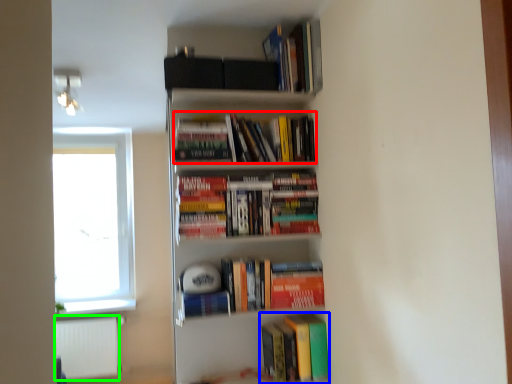
Question: Which object is the farthest from book (highlighted by a red box)? Choose among these: book (highlighted by a blue box) or cabinet (highlighted by a green box).

Choices:
 (A) book
 (B) cabinet

Answer: (B)